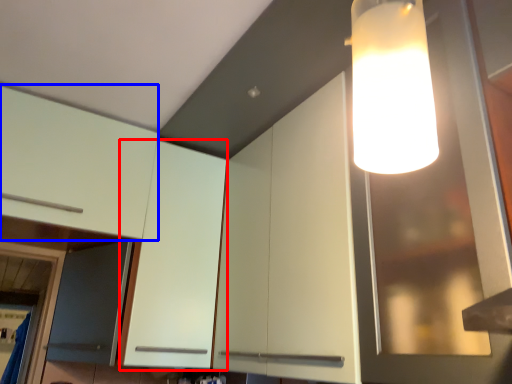
Question: Among these objects, which one is farthest to the camera, cabinetry (highlighted by a red box) or cabinetry (highlighted by a blue box)?

Choices:
 (A) cabinetry
 (B) cabinetry

Answer: (A)